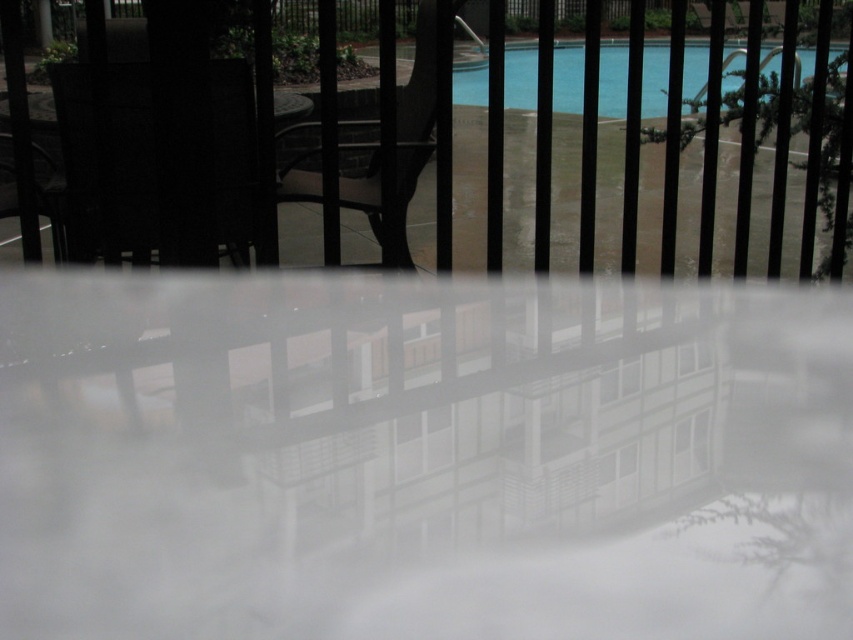
Question: Is white matte steam at center wider than matte black chair at center?

Choices:
 (A) no
 (B) yes

Answer: (B)

Question: Is white matte steam at center thinner than blue glossy water at upper center?

Choices:
 (A) yes
 (B) no

Answer: (A)

Question: From the image, what is the correct spatial relationship of matte black chair at left in relation to blue glossy water at upper center?

Choices:
 (A) below
 (B) above

Answer: (A)

Question: Which object is the closest to the black metal fence at center?

Choices:
 (A) matte black chair at left
 (B) white matte steam at center
 (C) blue glossy water at upper center

Answer: (B)

Question: Which of these objects is positioned closest to the matte black chair at center?

Choices:
 (A) matte black chair at left
 (B) white matte steam at center
 (C) blue glossy water at upper center
 (D) black metal fence at center

Answer: (D)

Question: Which of the following is the closest to the observer?

Choices:
 (A) matte black chair at center
 (B) black metal fence at center
 (C) matte black chair at left

Answer: (B)